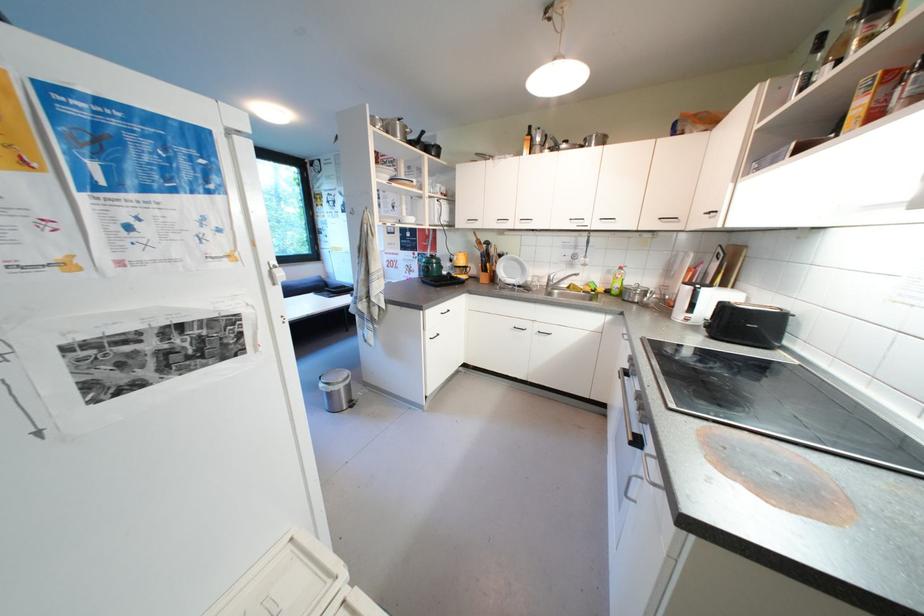
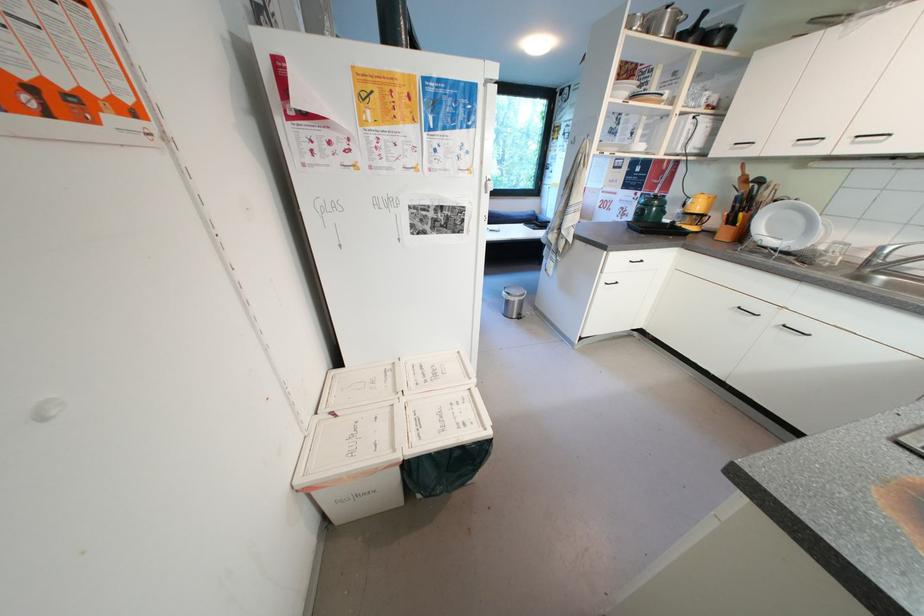
In the second image, find the point that corresponds to pixel 501 281 in the first image.

(749, 238)